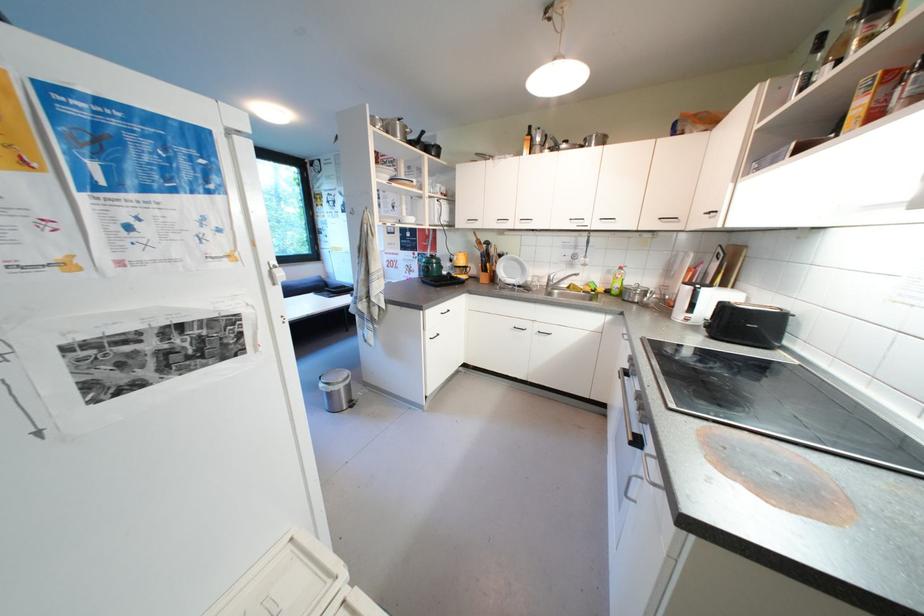
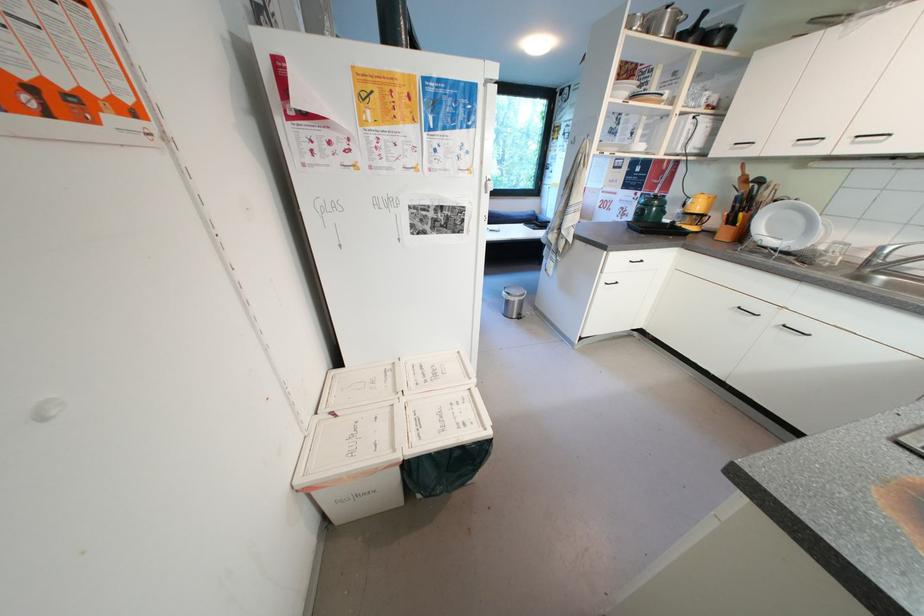
In the second image, find the point that corresponds to pixel 501 281 in the first image.

(749, 238)